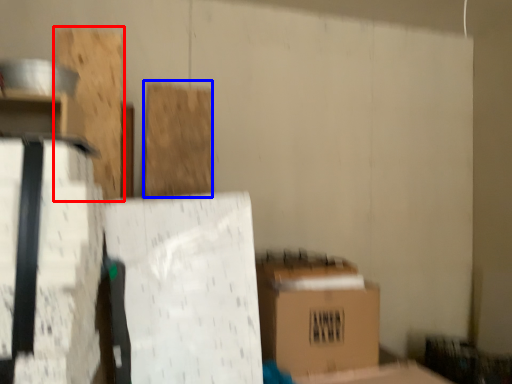
Question: Which object appears closest to the camera in this image, wood (highlighted by a red box) or wood (highlighted by a blue box)?

Choices:
 (A) wood
 (B) wood

Answer: (A)